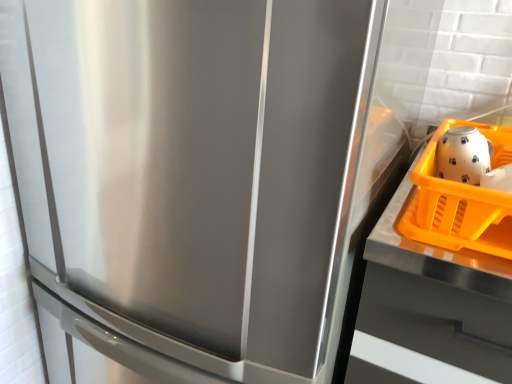
Question: Are orange plastic tray at right and orange plastic basket at right located far from each other?

Choices:
 (A) no
 (B) yes

Answer: (A)

Question: Is orange plastic tray at right not within orange plastic basket at right?

Choices:
 (A) no
 (B) yes

Answer: (B)

Question: Does orange plastic tray at right have a lesser height compared to orange plastic basket at right?

Choices:
 (A) yes
 (B) no

Answer: (B)

Question: Considering the relative positions of orange plastic tray at right and orange plastic basket at right in the image provided, is orange plastic tray at right to the right of orange plastic basket at right from the viewer's perspective?

Choices:
 (A) yes
 (B) no

Answer: (A)

Question: From a real-world perspective, is orange plastic tray at right under orange plastic basket at right?

Choices:
 (A) yes
 (B) no

Answer: (A)

Question: Relative to orange plastic basket at right, is white glossy tea pot at upper right in front or behind?

Choices:
 (A) front
 (B) behind

Answer: (B)

Question: Is white glossy tea pot at upper right taller or shorter than orange plastic basket at right?

Choices:
 (A) short
 (B) tall

Answer: (A)

Question: From a real-world perspective, relative to orange plastic basket at right, is white glossy tea pot at upper right vertically above or below?

Choices:
 (A) above
 (B) below

Answer: (A)

Question: Is point (455, 145) positioned closer to the camera than point (498, 251)?

Choices:
 (A) farther
 (B) closer

Answer: (A)

Question: From their relative heights in the image, would you say orange plastic basket at right is taller or shorter than white glossy tea pot at upper right?

Choices:
 (A) tall
 (B) short

Answer: (A)

Question: Is orange plastic basket at right spatially inside white glossy tea pot at upper right, or outside of it?

Choices:
 (A) inside
 (B) outside

Answer: (B)

Question: Based on their positions, is orange plastic basket at right located to the left or right of white glossy tea pot at upper right?

Choices:
 (A) left
 (B) right

Answer: (B)

Question: From a real-world perspective, is orange plastic basket at right above or below white glossy tea pot at upper right?

Choices:
 (A) above
 (B) below

Answer: (B)

Question: From the image's perspective, is orange plastic tray at right positioned above or below white glossy tea pot at upper right?

Choices:
 (A) below
 (B) above

Answer: (A)

Question: Does point (467, 375) appear closer or farther from the camera than point (455, 173)?

Choices:
 (A) farther
 (B) closer

Answer: (B)